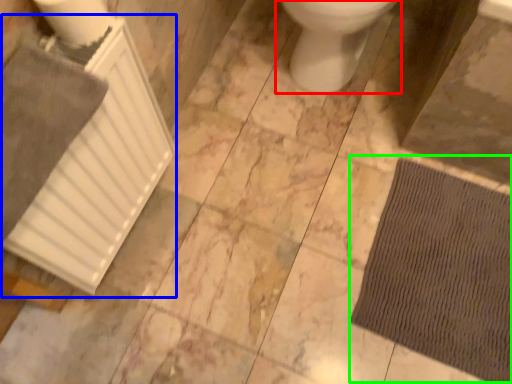
Question: Estimate the real-world distances between objects in this image. Which object is farther from toilet (highlighted by a red box), radiator (highlighted by a blue box) or doormat (highlighted by a green box)?

Choices:
 (A) radiator
 (B) doormat

Answer: (A)